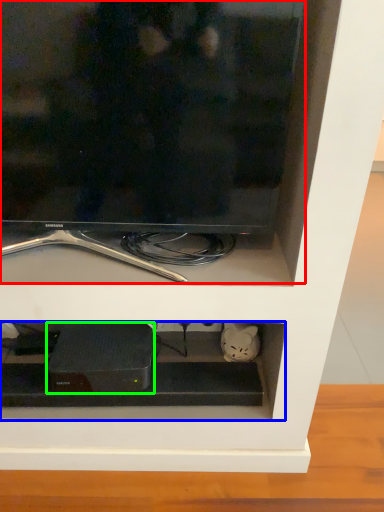
Question: Which object is positioned closest to television (highlighted by a red box)? Select from cabinet (highlighted by a blue box) and appliance (highlighted by a green box).

Choices:
 (A) cabinet
 (B) appliance

Answer: (A)